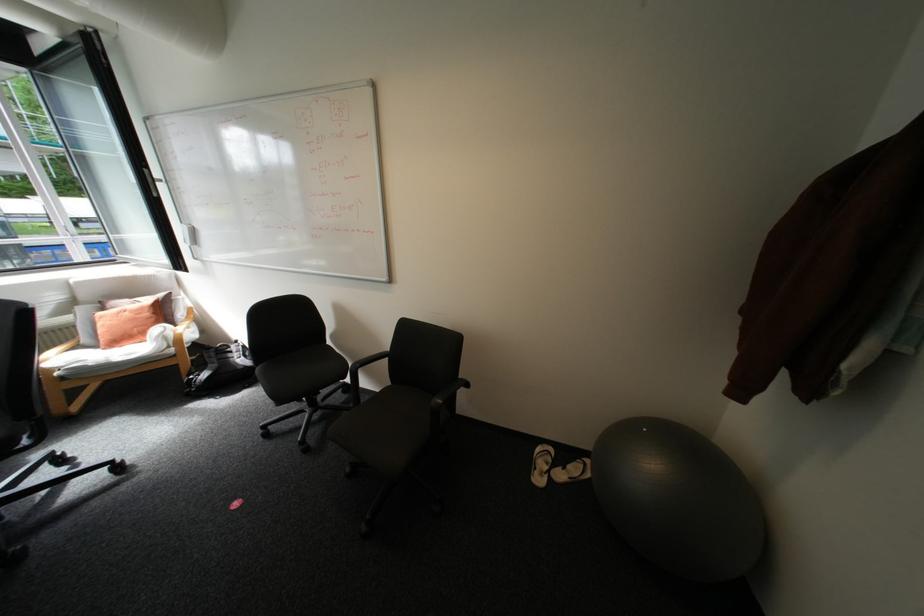
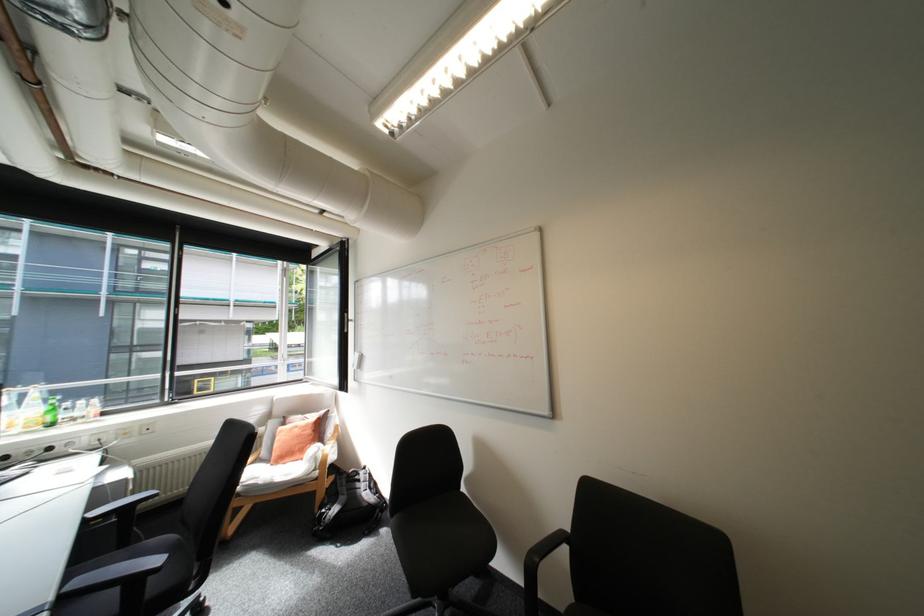
Question: I am providing you with two images of the same scene from different viewpoints. After the viewpoint changes to image2, which objects are now occluded?

Choices:
 (A) black backpack
 (B) whiteboard eraser
 (C) clear plastic bottle
 (D) none of these

Answer: (D)